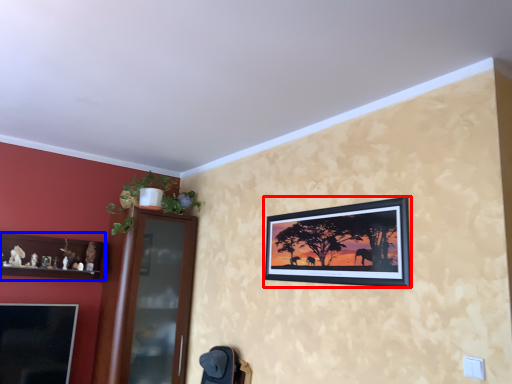
Question: Which object is closer to the camera taking this photo, picture frame (highlighted by a red box) or shelf (highlighted by a blue box)?

Choices:
 (A) picture frame
 (B) shelf

Answer: (A)